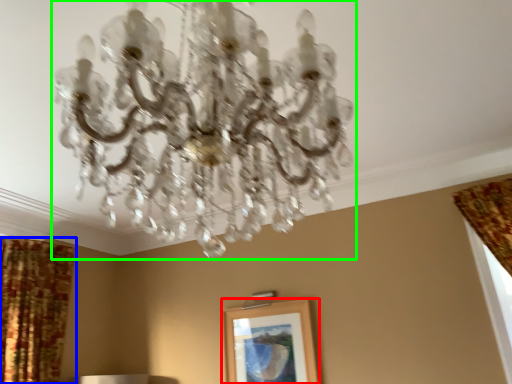
Question: Estimate the real-world distances between objects in this image. Which object is farther from picture frame (highlighted by a red box), curtain (highlighted by a blue box) or lamp (highlighted by a green box)?

Choices:
 (A) curtain
 (B) lamp

Answer: (B)